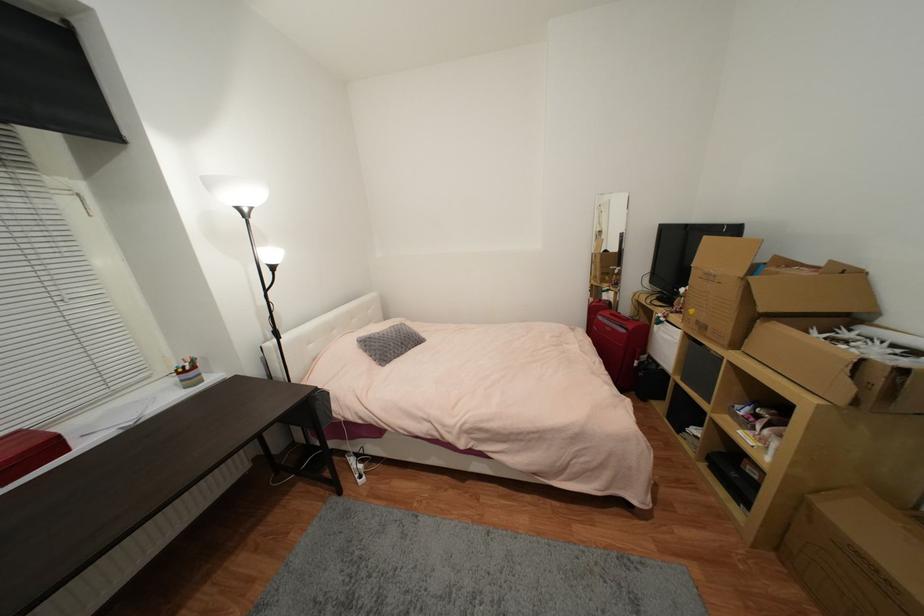
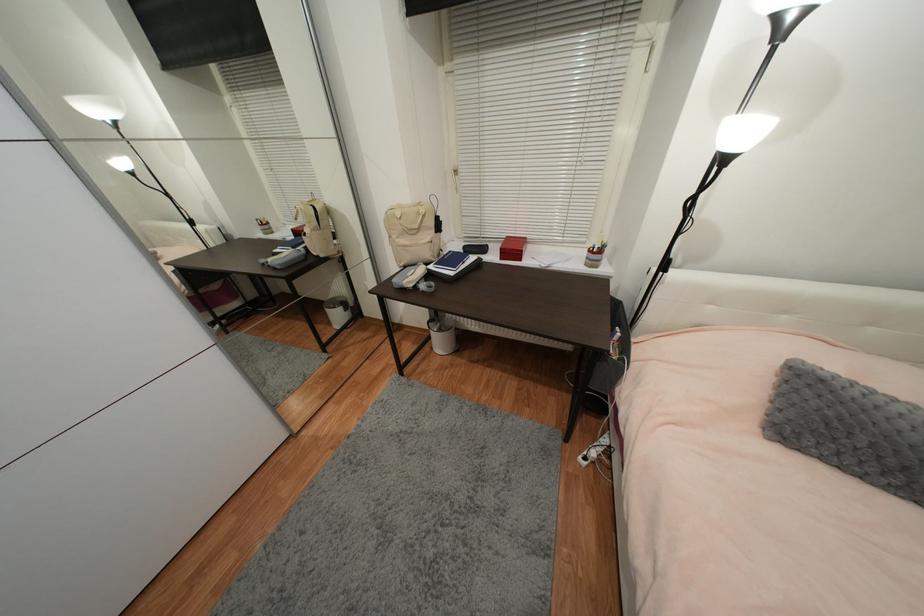
First-person continuous shooting, in which direction is the camera rotating?

The camera rotated toward left-down.